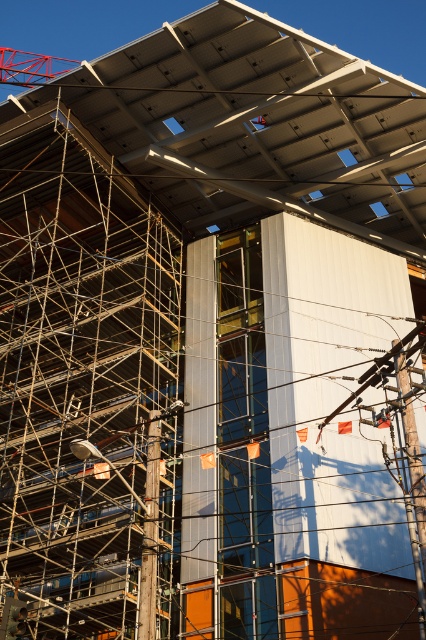
You are a construction worker standing at the base of the building. You need to move a heavy beam from the metallic red crane at upper left to the metallic scaffolding at left. Which direction should you move the beam to place it on the scaffolding?

The metallic scaffolding at left is to the right of the metallic red crane at upper left, so you should move the beam to the right to place it on the metallic scaffolding at left.

From the picture: You are a construction worker who needs to determine if the metallic scaffolding at left can support the height of the metallic red crane at upper left. Based on the scene, can the scaffolding reach the height of the crane?

The metallic scaffolding at left is much taller than the metallic red crane at upper left, so yes, the scaffolding can support the height of the crane.

You are a construction worker standing at the base of the building. You need to move a heavy beam from the metallic red crane at upper left to the area near the metallic scaffolding at left. Which object is closer to your current position?

The metallic scaffolding at left is closer to the viewer than the metallic red crane at upper left, so the metallic scaffolding at left is closer to your current position.